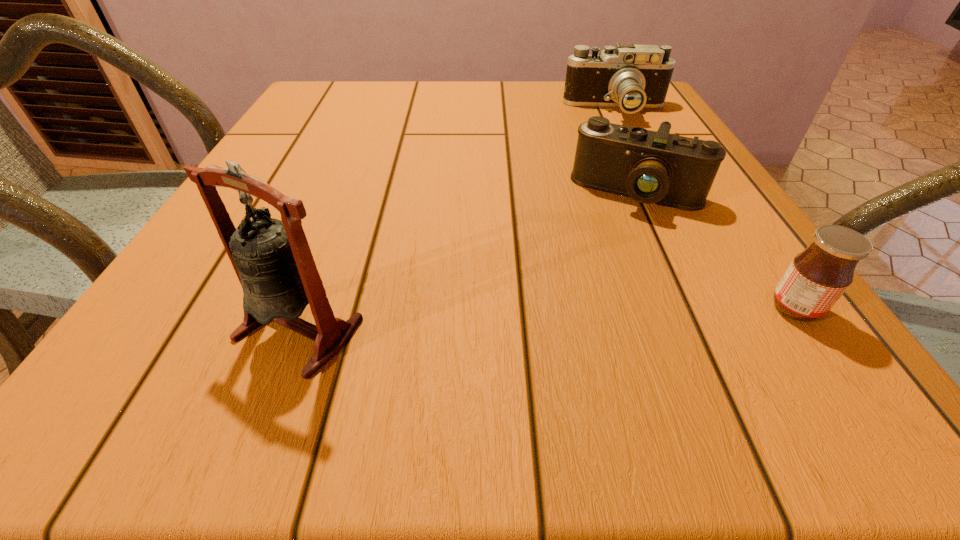
Identify the location of free location located 0.090m on the lens of the second farthest object. The width and height of the screenshot is (960, 540). (608, 247).

You are a GUI agent. You are given a task and a screenshot of the screen. Output one action in this format:
    pyautogui.click(x=<x>, y=<y>)
    Task: Click on the vacant space located 0.240m on the lens of the second farthest object
    The height and width of the screenshot is (540, 960).
    Given the screenshot: What is the action you would take?
    pyautogui.click(x=584, y=311)

Where is `object located in the far edge section of the desktop`? The width and height of the screenshot is (960, 540). object located in the far edge section of the desktop is located at coordinates (633, 77).

Locate an element on the screen. bell that is at the near edge is located at coordinates (272, 259).

The image size is (960, 540). Find the location of `jam at the near edge`. jam at the near edge is located at coordinates (817, 277).

Locate an element on the screen. The image size is (960, 540). object present at the left edge is located at coordinates (272, 259).

Locate an element on the screen. This screenshot has height=540, width=960. jam at the right edge is located at coordinates (817, 277).

This screenshot has width=960, height=540. In order to click on object positioned at the near left corner in this screenshot , I will do `click(272, 259)`.

Locate an element on the screen. The width and height of the screenshot is (960, 540). object at the far right corner is located at coordinates (633, 77).

Identify the location of object that is at the near right corner. (817, 277).